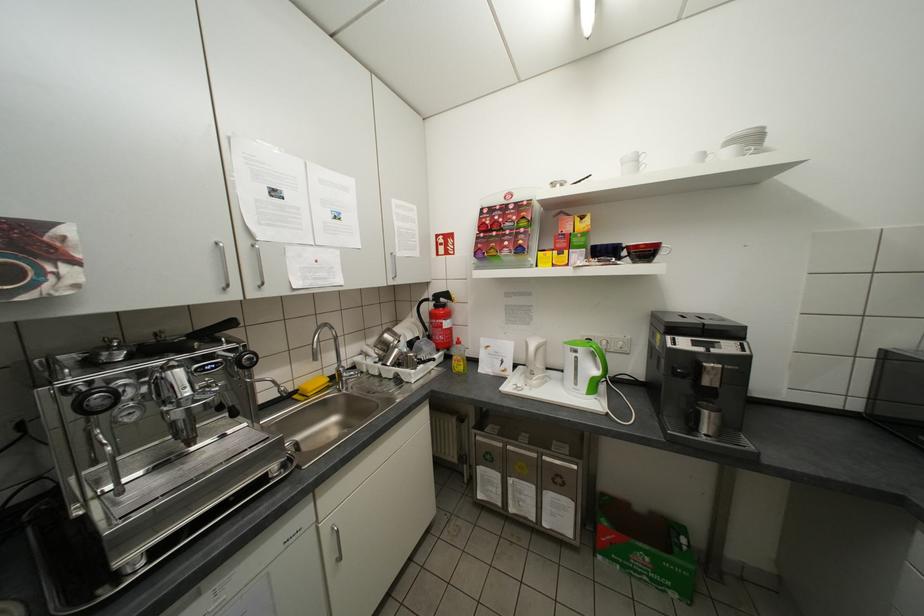
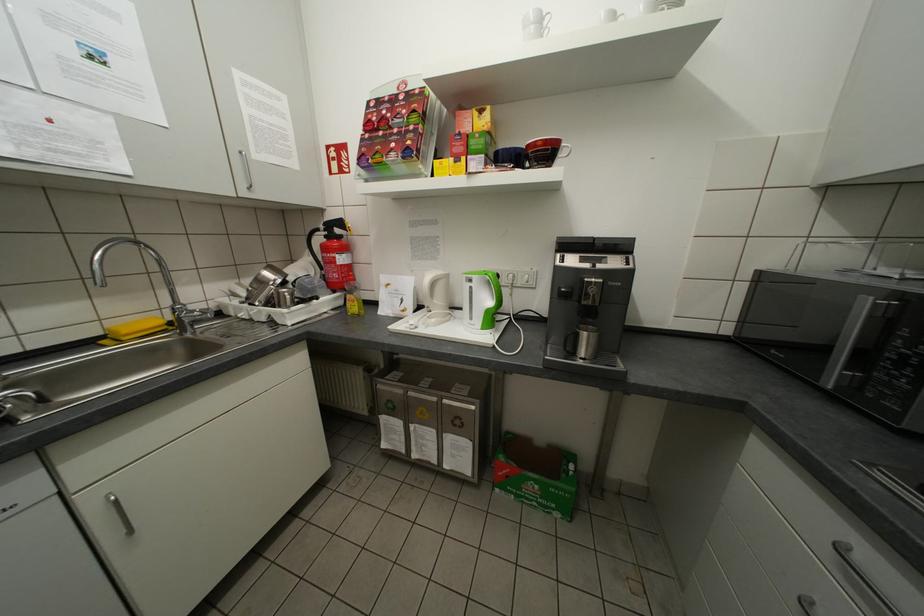
In the second image, find the point that corresponds to [346,371] in the first image.

(181, 309)